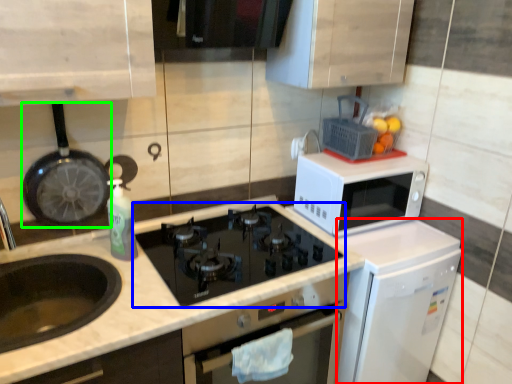
Question: Which is farther away from dish washer (highlighted by a red box)? gas stove (highlighted by a blue box) or frying pan (highlighted by a green box)?

Choices:
 (A) gas stove
 (B) frying pan

Answer: (B)